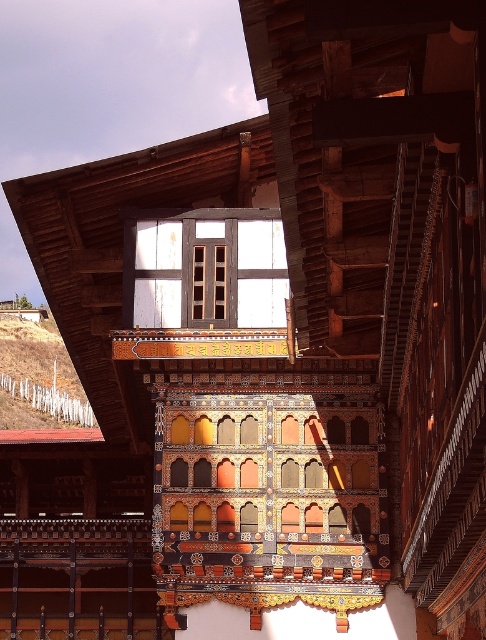
You are standing in front of a traditional Bhutanese building and notice the white painted wood at center and the brown grass at lower left. Which of these two elements is shorter in height?

The white painted wood at center is shorter compared to the brown grass at lower left.